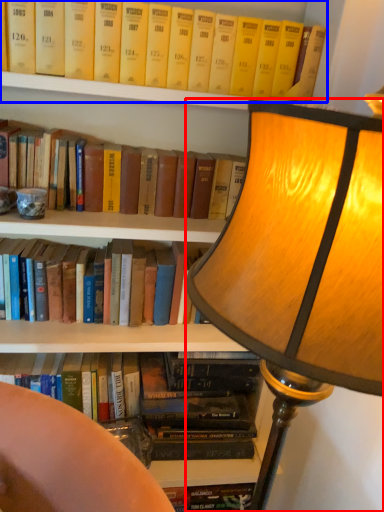
Question: Among these objects, which one is farthest to the camera, lamp (highlighted by a red box) or book (highlighted by a blue box)?

Choices:
 (A) lamp
 (B) book

Answer: (B)